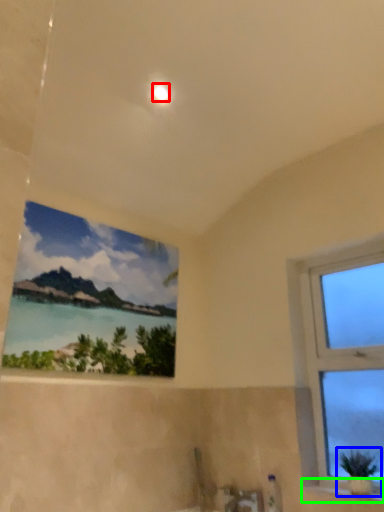
Question: Which is farther away from light (highlighted by a red box)? houseplant (highlighted by a blue box) or window sill (highlighted by a green box)?

Choices:
 (A) houseplant
 (B) window sill

Answer: (B)